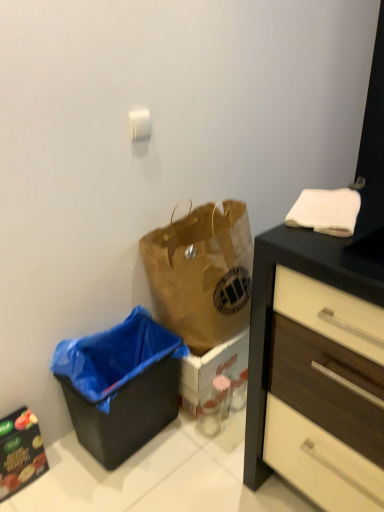
Question: Is black glossy cabinet at lower left in front of or behind black plastic recycling bin at lower left in the image?

Choices:
 (A) front
 (B) behind

Answer: (B)

Question: From their relative heights in the image, would you say black glossy cabinet at lower left is taller or shorter than black plastic recycling bin at lower left?

Choices:
 (A) tall
 (B) short

Answer: (B)

Question: Which of these objects is positioned farthest from the brown paper bag at center?

Choices:
 (A) black glossy cabinet at lower left
 (B) black plastic recycling bin at lower left

Answer: (A)

Question: Which object is positioned farthest from the black plastic recycling bin at lower left?

Choices:
 (A) brown paper bag at center
 (B) black glossy cabinet at lower left

Answer: (B)